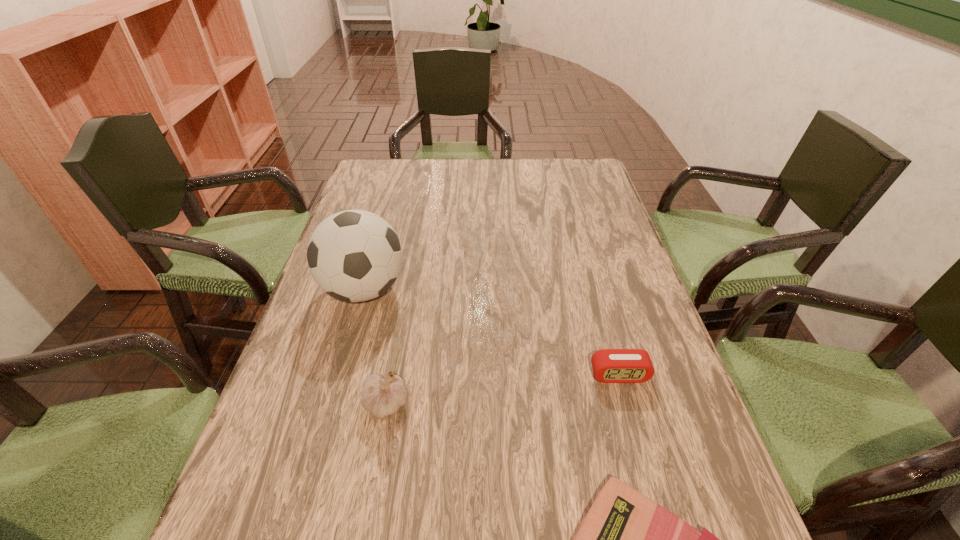
Where is `vacant area between the garlic and the tallest object`? vacant area between the garlic and the tallest object is located at coordinates (375, 347).

Where is `vacant point located between the second farthest object and the tallest object`? Image resolution: width=960 pixels, height=540 pixels. vacant point located between the second farthest object and the tallest object is located at coordinates point(492,332).

The image size is (960, 540). I want to click on object that stands as the second closest to the second nearest object, so click(626, 539).

Image resolution: width=960 pixels, height=540 pixels. Identify the location of the closest object relative to the soccer ball. tap(382, 397).

Where is `vacant space that satisfies the following two spatial constraints: 1. on the front side of the tallest object; 2. on the left side of the third shortest object`? The height and width of the screenshot is (540, 960). vacant space that satisfies the following two spatial constraints: 1. on the front side of the tallest object; 2. on the left side of the third shortest object is located at coordinates (331, 405).